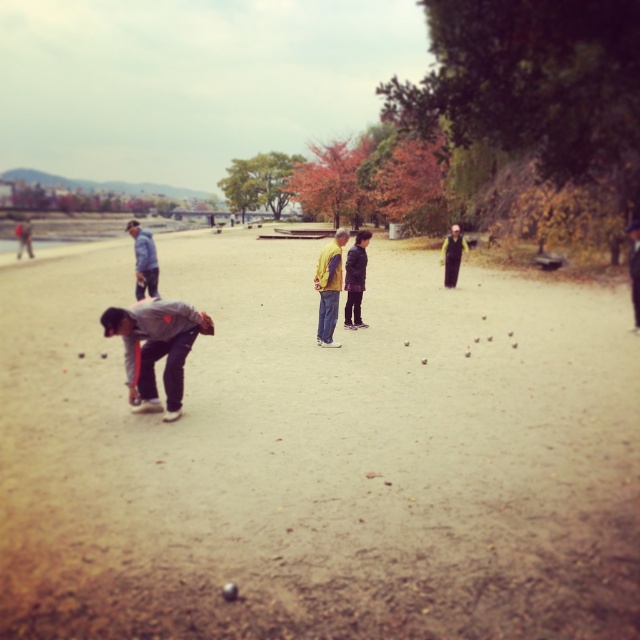
Question: Estimate the real-world distances between objects in this image. Which object is closer to the yellow jacket at center?

Choices:
 (A) dark gray jacket at center
 (B) gray fabric jacket at lower left
 (C) gray hoodie at center
 (D) black fabric jacket at center

Answer: (B)

Question: Can you confirm if yellow jacket at center is positioned to the left of black fabric jacket at center?

Choices:
 (A) no
 (B) yes

Answer: (B)

Question: Which object appears farthest from the camera in this image?

Choices:
 (A) brown sandy ground at center
 (B) dark gray jacket at center
 (C) dark gray hoodie at center

Answer: (C)

Question: Does brown sandy ground at center have a smaller size compared to dark gray jacket at center?

Choices:
 (A) no
 (B) yes

Answer: (A)

Question: Does gray hoodie at center appear on the left side of black fabric jacket at center?

Choices:
 (A) yes
 (B) no

Answer: (A)

Question: Which object is farther from the camera taking this photo?

Choices:
 (A) gray hoodie at center
 (B) gray fabric jacket at lower left

Answer: (A)